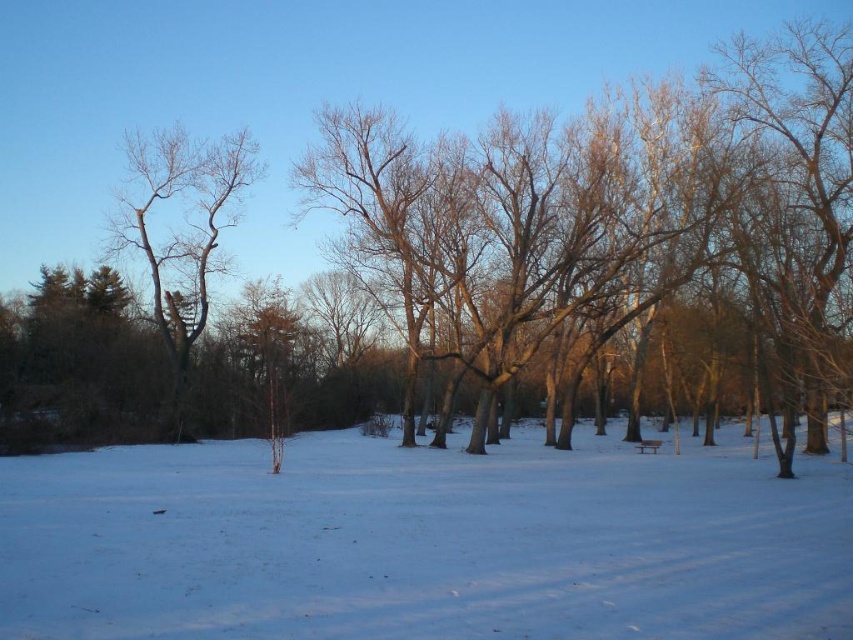
You are a winter explorer standing at the edge of the snowy area. You see the white powdery snow at center and the bare branches at left. Which object is located to the right of the other?

The white powdery snow at center is positioned on the right side of bare branches at left.

You are standing in the winter park scene. You see the white powdery snow at center and the bare branches at left. Which object is located lower in the image?

The white powdery snow at center is located lower than the bare branches at left in the image.

You are standing in the winter scene and want to place a small snowman exactly at the center of the white powdery snow at center. According to the coordinates provided, where should you place the snowman?

The white powdery snow at center is located at coordinates point (422, 541), so you should place the snowman at that point.